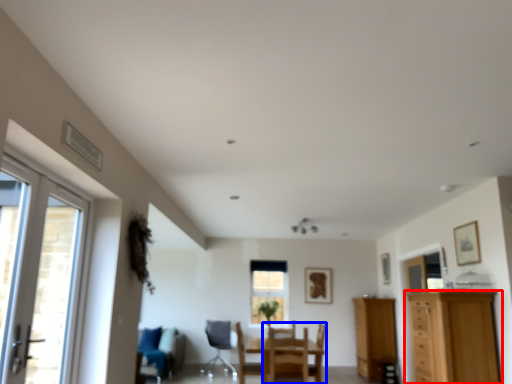
Question: Which object appears closest to the camera in this image, cabinetry (highlighted by a red box) or chair (highlighted by a blue box)?

Choices:
 (A) cabinetry
 (B) chair

Answer: (A)